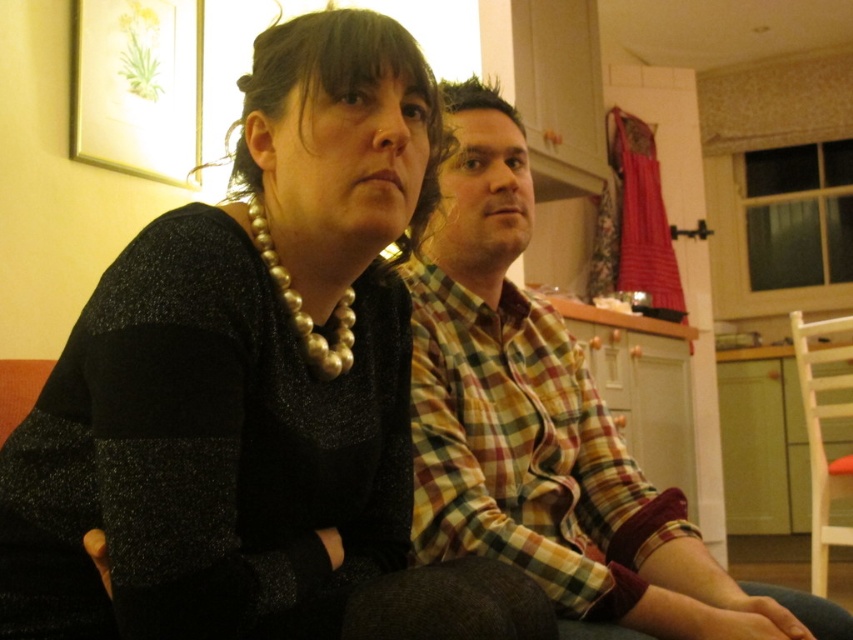
Can you confirm if checkered fabric shirt at center is smaller than plaid fabric shirt at center?

No.

In the scene shown: Can you confirm if checkered fabric shirt at center is thinner than plaid fabric shirt at center?

In fact, checkered fabric shirt at center might be wider than plaid fabric shirt at center.

Does point (524, 541) come in front of point (537, 529)?

Yes, it is.

At what (x,y) coordinates should I click in order to perform the action: click on checkered fabric shirt at center. Please return your answer as a coordinate pair (x, y). Looking at the image, I should click on (544, 426).